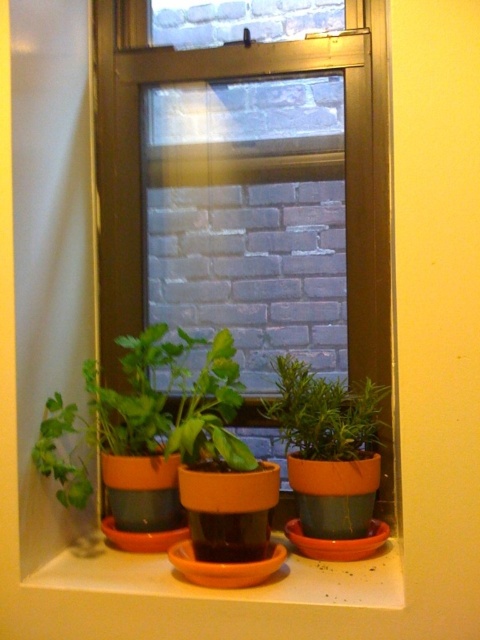
You are a gardener who wants to water the plants in the image. You notice the orange clay pot at lower center and the green matte plant at center. Which object is closer to you, the observer?

The orange clay pot at lower center is closer to you because it is in front of the green matte plant at center.

You are a gardener trying to place a new plant on the windowsill. The metallic brown window frame at center is already there. You have an orange clay pot at lower center that needs to be positioned 24 inches away from the window frame. Is the current distance sufficient?

The metallic brown window frame at center and orange clay pot at lower center are currently 20.34 inches apart, which is less than the required 24 inches. Therefore, the current distance is not sufficient, and the orange clay pot at lower center needs to be moved further away to meet the 24 inches requirement.

You are standing in front of the windowsill garden and want to place a new plant between the two points marked as point (360,10) and point (86,577). Which point should you stand closer to in order to place the new plant in the middle of the two points?

To place the new plant in the middle between point (360,10) and point (86,577), you should stand closer to point (86,577) because point (360,10) is further away from the viewer. The midpoint would require balancing the distance from both points, so positioning closer to the nearer point ensures the plant is centered.